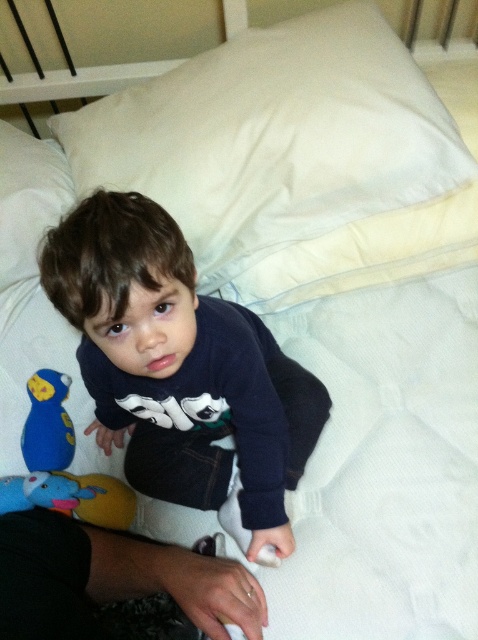
You are a parent trying to place a pacifier between the white soft pillow at upper center and the blue plush toy at lower left. The pacifier is 1 inch long. Can you fit it in the space between them?

The distance between the white soft pillow at upper center and the blue plush toy at lower left is 22.31 inches, so yes, the pacifier which is 1 inch long can easily fit in the space between them.

You are a photographer taking a picture of the child on the bed. You need to place a small sticker on the white soft pillow at upper left for a photo prop. Where exactly should you place the sticker on the pillow?

The sticker should be placed at the coordinates point (29, 198) on the white soft pillow at upper left as specified in the 2D location.

You are a parent trying to organize your childroom. You want to place the dark blue sweater at center and the blue plush toy at lower left on a shelf. The shelf is 12 inches wide. Can both items fit side by side without overlapping?

The dark blue sweater at center is 10.49 inches from the blue plush toy at lower left. Since the total distance between them is less than the shelf width of 12 inches, both items can fit side by side on the shelf without overlapping.